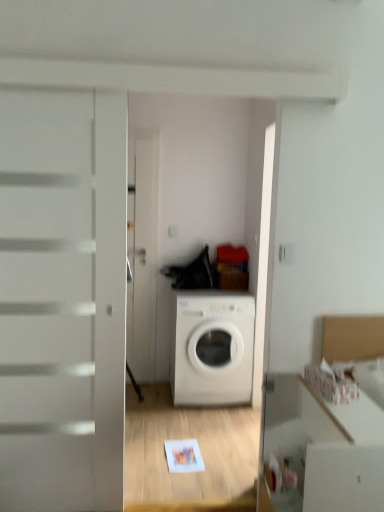
What is the approximate height of white glossy cabinet at lower right?

white glossy cabinet at lower right is 28.07 inches tall.

I want to click on white glossy cabinet at lower right, so click(x=352, y=337).

Describe the element at coordinates (352, 337) in the screenshot. The height and width of the screenshot is (512, 384). I see `white glossy cabinet at lower right` at that location.

This screenshot has height=512, width=384. I want to click on white glossy washing machine at center, so click(x=211, y=347).

Describe the element at coordinates (211, 347) in the screenshot. This screenshot has height=512, width=384. I see `white glossy washing machine at center` at that location.

I want to click on white glossy cabinet at lower right, so click(352, 337).

Considering the relative positions of white glossy washing machine at center and white glossy cabinet at lower right in the image provided, is white glossy washing machine at center to the left of white glossy cabinet at lower right from the viewer's perspective?

Yes.

Is the depth of white glossy washing machine at center greater than that of white glossy cabinet at lower right?

Yes, it is.

Considering the positions of point (219, 361) and point (378, 319), is point (219, 361) closer or farther from the camera than point (378, 319)?

Clearly, point (219, 361) is more distant from the camera than point (378, 319).

From the image's perspective, would you say white glossy washing machine at center is shown under white glossy cabinet at lower right?

Incorrect, from the image's perspective, white glossy washing machine at center is higher than white glossy cabinet at lower right.

From a real-world perspective, is white glossy washing machine at center on white glossy cabinet at lower right?

No.

Considering the sizes of white glossy washing machine at center and white glossy cabinet at lower right in the image, is white glossy washing machine at center wider or thinner than white glossy cabinet at lower right?

In the image, white glossy washing machine at center appears to be wider than white glossy cabinet at lower right.

In terms of height, does white glossy washing machine at center look taller or shorter compared to white glossy cabinet at lower right?

Clearly, white glossy washing machine at center is taller compared to white glossy cabinet at lower right.

Looking at this image, which of these two, white glossy washing machine at center or white glossy cabinet at lower right, is bigger?

Bigger between the two is white glossy washing machine at center.

Looking at this image, do you think white glossy washing machine at center is within white glossy cabinet at lower right, or outside of it?

white glossy washing machine at center is not enclosed by white glossy cabinet at lower right.

Is white glossy washing machine at center positioned far away from white glossy cabinet at lower right?

Yes, white glossy washing machine at center and white glossy cabinet at lower right are located far from each other.

Consider the image. Is white glossy washing machine at center facing away from white glossy cabinet at lower right?

No, white glossy washing machine at center is not facing the opposite direction of white glossy cabinet at lower right.

What's the angular difference between white glossy washing machine at center and white glossy cabinet at lower right's facing directions?

white glossy washing machine at center and white glossy cabinet at lower right are facing 91.6 degrees away from each other.

Where is `cabinetry located above the white glossy washing machine at center (from a real-world perspective)`? The height and width of the screenshot is (512, 384). cabinetry located above the white glossy washing machine at center (from a real-world perspective) is located at coordinates (352, 337).

Does white glossy cabinet at lower right appear on the left side of white glossy washing machine at center?

In fact, white glossy cabinet at lower right is to the right of white glossy washing machine at center.

Looking at this image, does white glossy cabinet at lower right come behind white glossy washing machine at center?

No, white glossy cabinet at lower right is closer to the viewer.

Considering the points (348, 349) and (239, 334), which point is in front, point (348, 349) or point (239, 334)?

Positioned in front is point (348, 349).

From the image's perspective, is white glossy cabinet at lower right positioned above or below white glossy washing machine at center?

Based on their image positions, white glossy cabinet at lower right is located beneath white glossy washing machine at center.

From a real-world perspective, which is physically above, white glossy cabinet at lower right or white glossy washing machine at center?

white glossy cabinet at lower right is physically above.

Considering the sizes of objects white glossy cabinet at lower right and white glossy washing machine at center in the image provided, who is wider, white glossy cabinet at lower right or white glossy washing machine at center?

white glossy washing machine at center is wider.

Is white glossy cabinet at lower right taller than white glossy washing machine at center?

In fact, white glossy cabinet at lower right may be shorter than white glossy washing machine at center.

Between white glossy cabinet at lower right and white glossy washing machine at center, which one has smaller size?

Smaller between the two is white glossy cabinet at lower right.

Would you say white glossy cabinet at lower right contains white glossy washing machine at center?

No, white glossy washing machine at center is not a part of white glossy cabinet at lower right.

Is white glossy cabinet at lower right far away from white glossy washing machine at center?

Indeed, white glossy cabinet at lower right is not near white glossy washing machine at center.

Could you tell me if white glossy cabinet at lower right is turned towards white glossy washing machine at center?

No, white glossy cabinet at lower right is not aimed at white glossy washing machine at center.

How different are the orientations of white glossy cabinet at lower right and white glossy washing machine at center in degrees?

91.6 degrees separate the facing orientations of white glossy cabinet at lower right and white glossy washing machine at center.

At what (x,y) coordinates should I click in order to perform the action: click on cabinetry in front of the white glossy washing machine at center. Please return your answer as a coordinate pair (x, y). Image resolution: width=384 pixels, height=512 pixels. Looking at the image, I should click on (352, 337).

Identify the location of cabinetry below the white glossy washing machine at center (from the image's perspective). (352, 337).

You are a GUI agent. You are given a task and a screenshot of the screen. Output one action in this format:
    pyautogui.click(x=<x>, y=<y>)
    Task: Click on the washing machine on the left of white glossy cabinet at lower right
    The height and width of the screenshot is (512, 384).
    Given the screenshot: What is the action you would take?
    pyautogui.click(x=211, y=347)